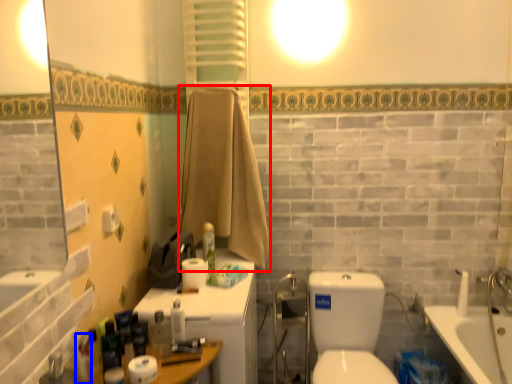
Question: Among these objects, which one is farthest to the camera, bath towel (highlighted by a red box) or toiletry (highlighted by a blue box)?

Choices:
 (A) bath towel
 (B) toiletry

Answer: (A)